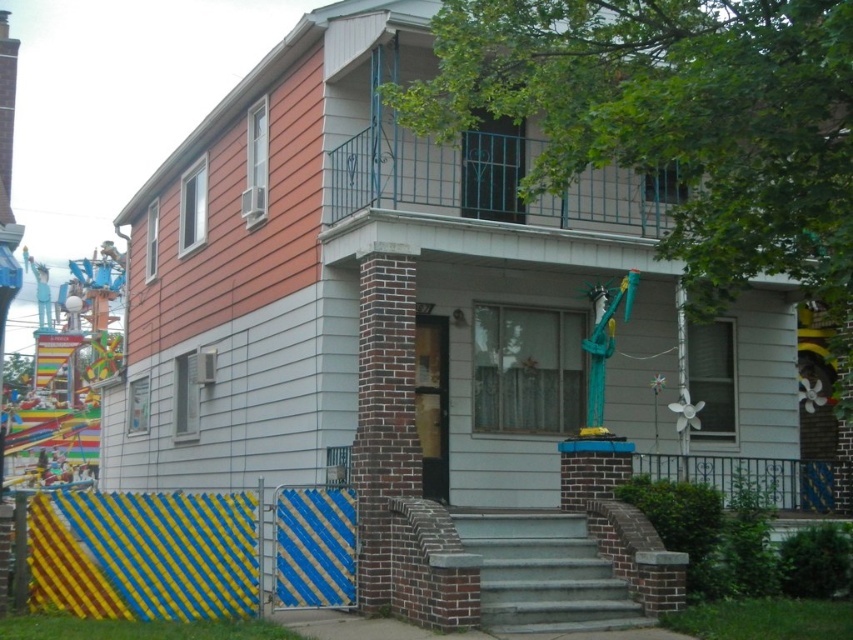
Is yellow and blue striped gate at lower left above gray concrete stairs at center?

Yes, yellow and blue striped gate at lower left is above gray concrete stairs at center.

Does yellow and blue striped gate at lower left appear on the right side of gray concrete stairs at center?

No, yellow and blue striped gate at lower left is not to the right of gray concrete stairs at center.

At what (x,y) coordinates should I click in order to perform the action: click on yellow and blue striped gate at lower left. Please return your answer as a coordinate pair (x, y). Looking at the image, I should click on (144, 554).

Where is `yellow and blue striped gate at lower left`? Image resolution: width=853 pixels, height=640 pixels. yellow and blue striped gate at lower left is located at coordinates (144, 554).